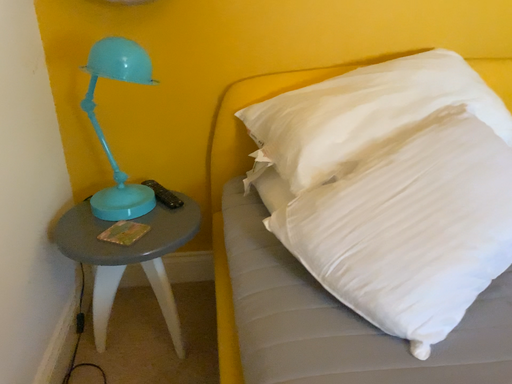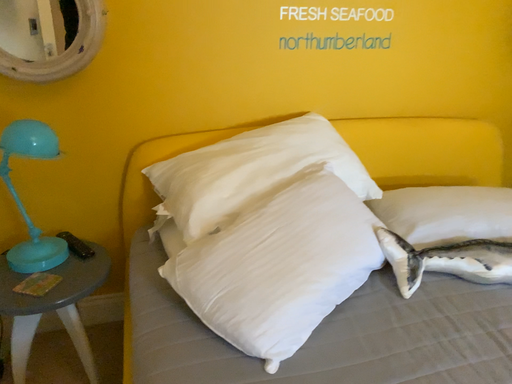
Question: How did the camera likely rotate when shooting the video?

Choices:
 (A) rotated left
 (B) rotated right

Answer: (B)